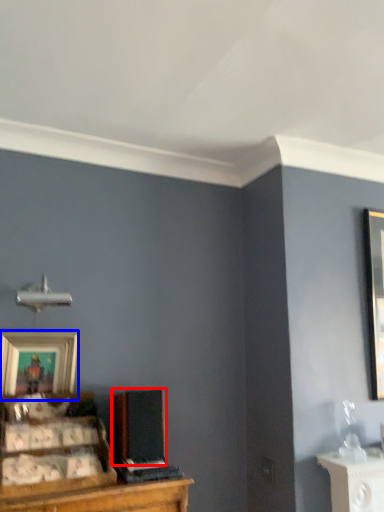
Question: Which point is further to the camera, speaker (highlighted by a red box) or picture frame (highlighted by a blue box)?

Choices:
 (A) speaker
 (B) picture frame

Answer: (B)